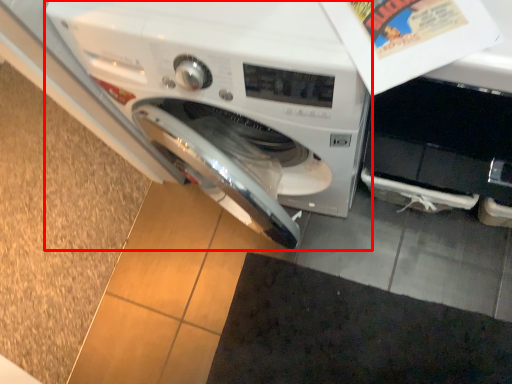
Question: From the image, what is the correct spatial relationship of washing machine (annotated by the red box) in relation to doormat?

Choices:
 (A) right
 (B) left

Answer: (B)